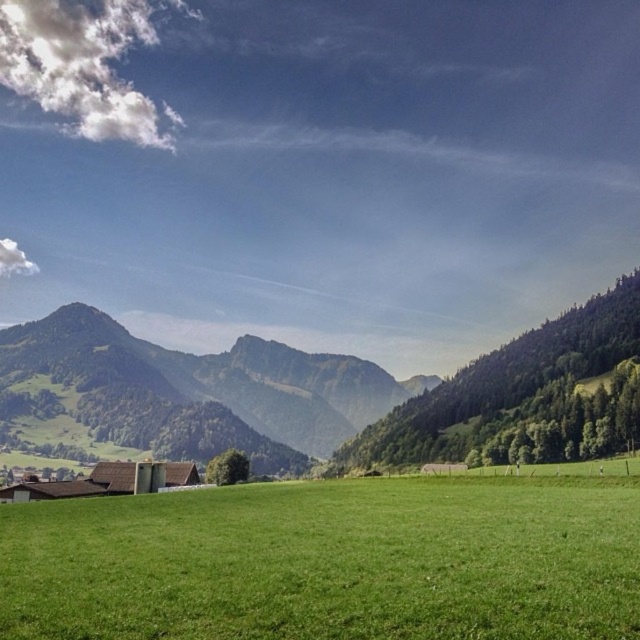
Question: Is green grassy field at lower left above green grassy mountain at left?

Choices:
 (A) no
 (B) yes

Answer: (B)

Question: Can you confirm if green grass pasture at center is positioned above green grassy mountain at left?

Choices:
 (A) no
 (B) yes

Answer: (B)

Question: Which object appears farthest from the camera in this image?

Choices:
 (A) green grassy field at lower left
 (B) green grassy mountain at left
 (C) green grass pasture at center

Answer: (B)

Question: Among these points, which one is farthest from the camera?

Choices:
 (A) (392, 401)
 (B) (241, 536)
 (C) (0, 387)

Answer: (A)

Question: Is green grass pasture at center further to the viewer compared to green grassy field at lower left?

Choices:
 (A) no
 (B) yes

Answer: (A)

Question: Which of these objects is positioned farthest from the green grass pasture at center?

Choices:
 (A) green grassy mountain at left
 (B) green grassy field at lower left

Answer: (A)